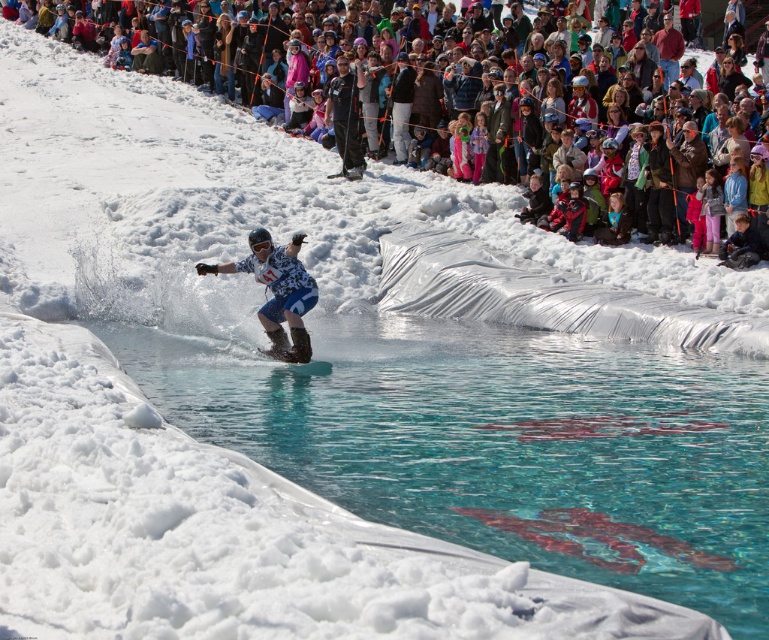
Question: Where is clear blue water at center located in relation to multicolored fabric crowd at upper center in the image?

Choices:
 (A) right
 (B) left

Answer: (A)

Question: Does multicolored fabric crowd at upper center have a smaller size compared to transparent plastic ramp at center?

Choices:
 (A) yes
 (B) no

Answer: (B)

Question: Which object appears closest to the camera in this image?

Choices:
 (A) transparent plastic ramp at center
 (B) clear blue water at center
 (C) multicolored fabric crowd at upper center
 (D) white snowboard at center

Answer: (B)

Question: Which point is closer to the camera?

Choices:
 (A) (215, 339)
 (B) (278, 355)

Answer: (B)

Question: Is clear blue water at center to the right of white snowboard at center from the viewer's perspective?

Choices:
 (A) yes
 (B) no

Answer: (A)

Question: Among these objects, which one is nearest to the camera?

Choices:
 (A) clear blue water at center
 (B) white snowboard at center
 (C) transparent plastic ramp at center
 (D) multicolored fabric crowd at upper center

Answer: (A)